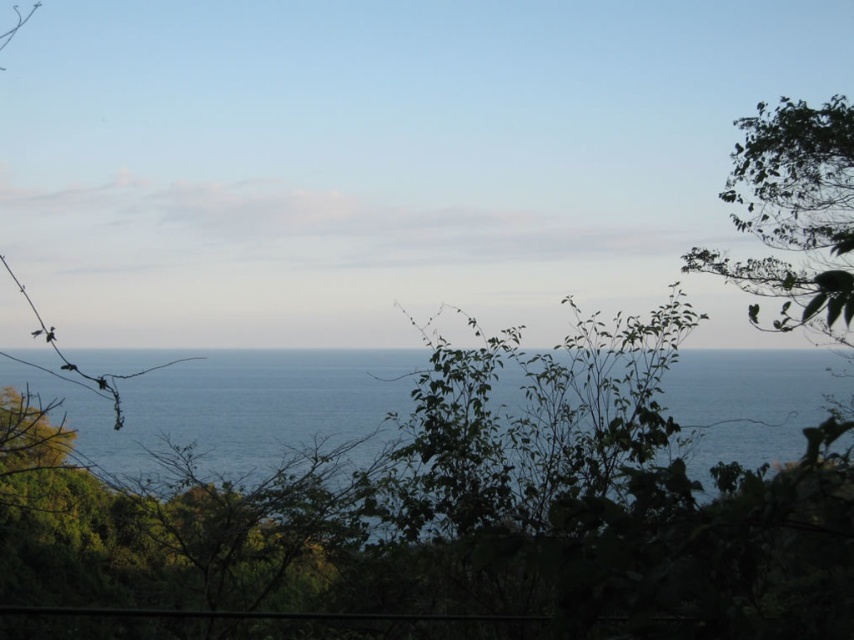
You are standing on the coast and see the blue water at center and the green leafy tree at upper right. Which object is closer to you?

The blue water at center is closer to you because the green leafy tree at upper right is behind it.

You are standing at the point marked as point (237, 404) in the coastal scene. What is the immediate environment around this point?

The point (237, 404) is on blue water at center, so the immediate environment around this point is surrounded by blue ocean water.